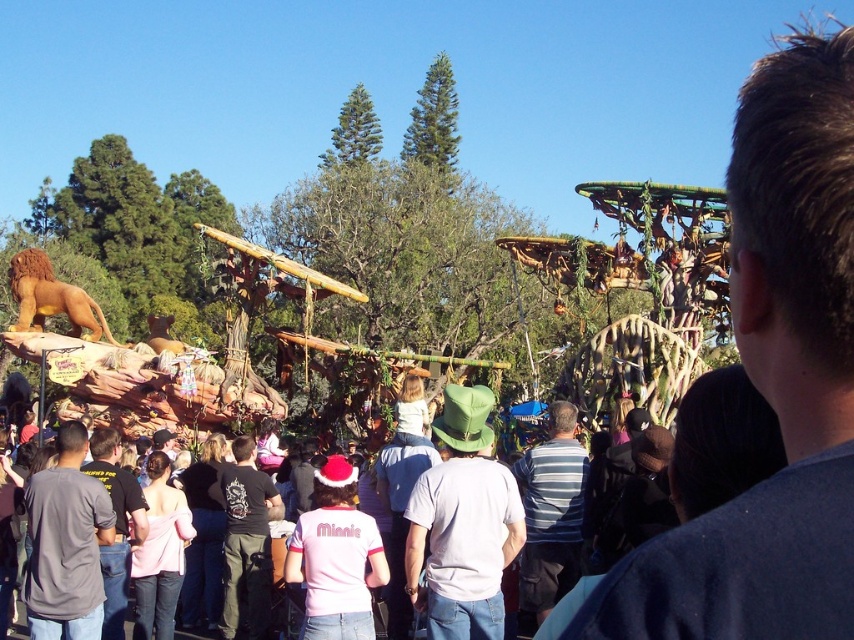
Is point (252, 561) closer to camera compared to point (109, 464)?

No, (252, 561) is behind (109, 464).

Who is positioned more to the right, black cotton shirt at center or dark gray shirt at center?

black cotton shirt at center

Between point (252, 561) and point (126, 509), which one is positioned in front?

Point (126, 509) is more forward.

This screenshot has height=640, width=854. Find the location of `black cotton shirt at center`. black cotton shirt at center is located at coordinates (244, 540).

Is the position of light pink fabric crowd at center less distant than that of black cotton shirt at center?

Yes, it is.

This screenshot has width=854, height=640. Identify the location of light pink fabric crowd at center. (115, 474).

At what (x,y) coordinates should I click in order to perform the action: click on light pink fabric crowd at center. Please return your answer as a coordinate pair (x, y). The width and height of the screenshot is (854, 640). Looking at the image, I should click on (115, 474).

Between green felt hat at center and gray cotton shirt at lower left, which one is positioned lower?

green felt hat at center is lower down.

I want to click on green felt hat at center, so click(x=463, y=524).